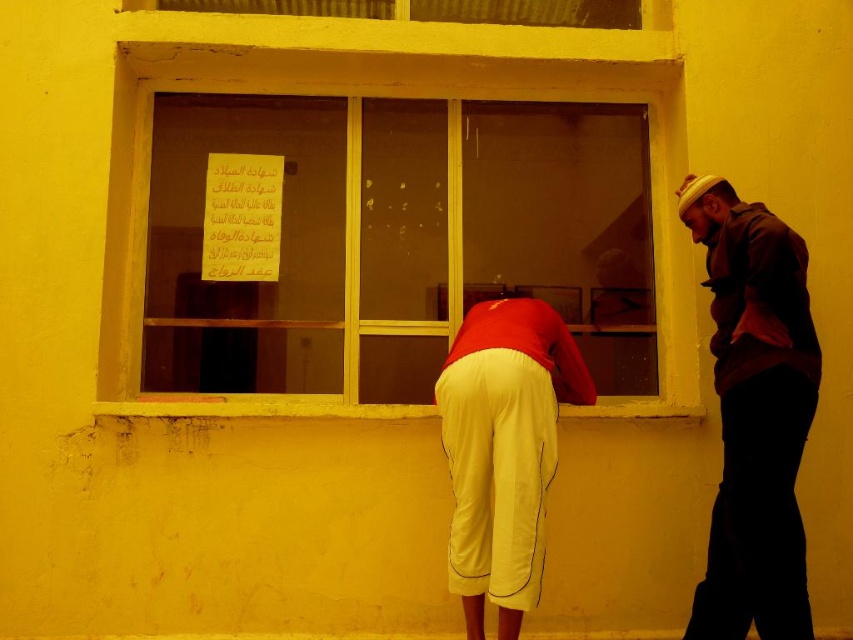
Does transparent glass window at center appear on the left side of dark brown leather jacket at right?

Correct, you'll find transparent glass window at center to the left of dark brown leather jacket at right.

Who is positioned more to the left, transparent glass window at center or dark brown leather jacket at right?

From the viewer's perspective, transparent glass window at center appears more on the left side.

Where is `transparent glass window at center`? Image resolution: width=853 pixels, height=640 pixels. transparent glass window at center is located at coordinates (384, 93).

Identify the location of transparent glass window at center. The image size is (853, 640). (384, 93).

Describe the element at coordinates (753, 413) in the screenshot. I see `red fabric shirt at center` at that location.

Which of these two, red fabric shirt at center or dark brown leather jacket at right, stands taller?

Standing taller between the two is red fabric shirt at center.

Describe the element at coordinates (753, 413) in the screenshot. I see `red fabric shirt at center` at that location.

Image resolution: width=853 pixels, height=640 pixels. Find the location of `red fabric shirt at center`. red fabric shirt at center is located at coordinates [x=753, y=413].

Between point (677, 410) and point (750, 275), which one is positioned in front?

Positioned in front is point (750, 275).

Can you confirm if transparent glass window at center is positioned to the right of red fabric shirt at center?

In fact, transparent glass window at center is to the left of red fabric shirt at center.

Where is `transparent glass window at center`? This screenshot has width=853, height=640. transparent glass window at center is located at coordinates (384, 93).